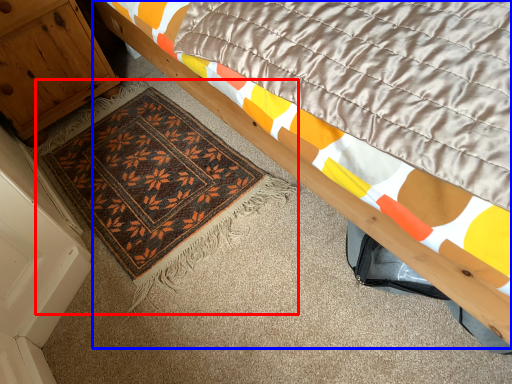
Question: Which of the following is the closest to the observer, mat (highlighted by a red box) or bed (highlighted by a blue box)?

Choices:
 (A) mat
 (B) bed

Answer: (B)